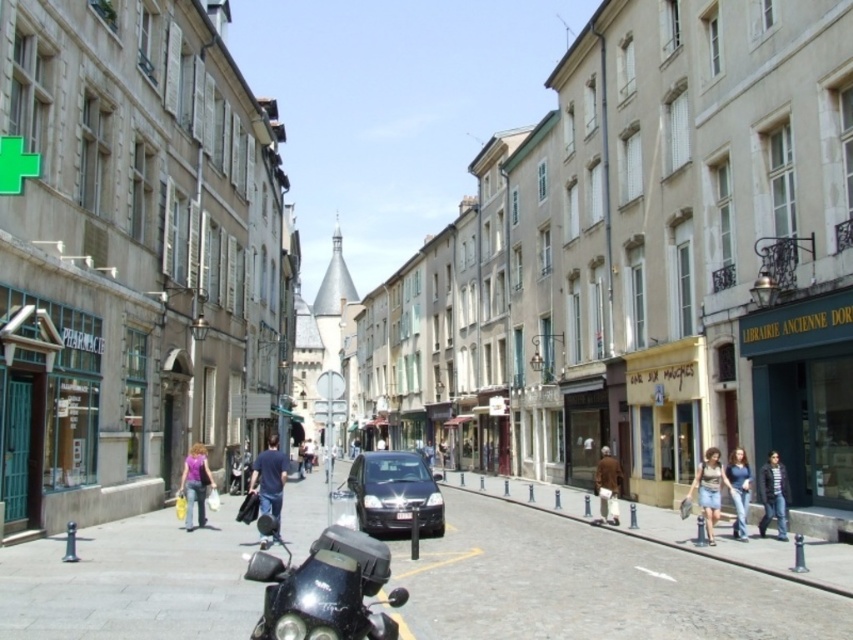
Question: Based on their relative distances, which object is nearer to the brown leather jacket at lower right?

Choices:
 (A) denim jacket at center
 (B) dark blue shirt at center

Answer: (B)

Question: Which object is the closest to the dark blue shirt at center?

Choices:
 (A) brown leather jacket at lower right
 (B) matte pink shirt at center
 (C) dark blue jeans at center
 (D) dark gray jacket at lower right

Answer: (B)

Question: Is the position of shiny black car at center less distant than that of dark blue jeans at center?

Choices:
 (A) no
 (B) yes

Answer: (B)

Question: Among these objects, which one is farthest from the camera?

Choices:
 (A) denim jacket at center
 (B) dark blue jeans at center

Answer: (B)

Question: Can you confirm if shiny black motorcycle at lower left is positioned below denim jacket at center?

Choices:
 (A) yes
 (B) no

Answer: (B)

Question: Does shiny black motorcycle at lower left appear on the left side of shiny black car at center?

Choices:
 (A) yes
 (B) no

Answer: (A)